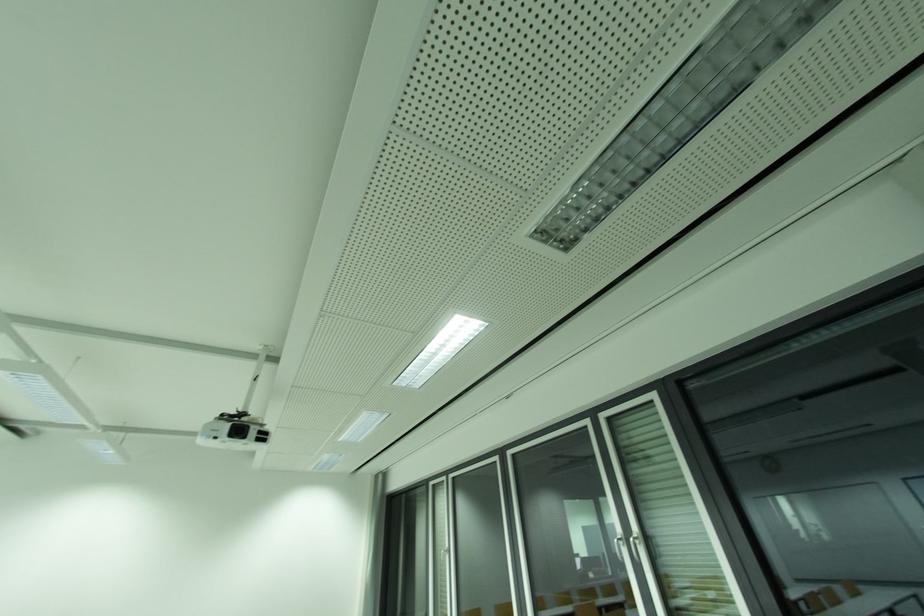
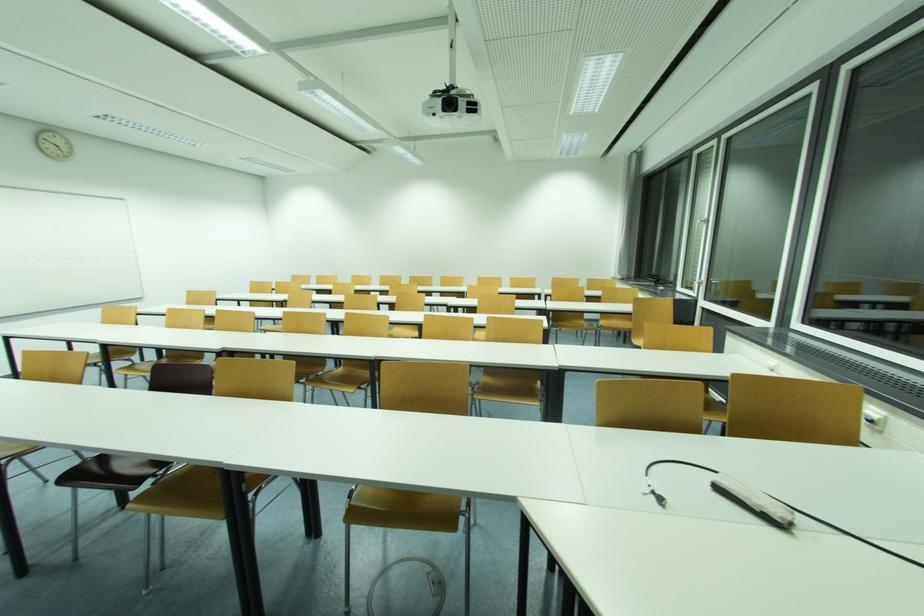
The first image is from the beginning of the video and the second image is from the end. How did the camera likely rotate when shooting the video?

The camera rotated toward left-down.